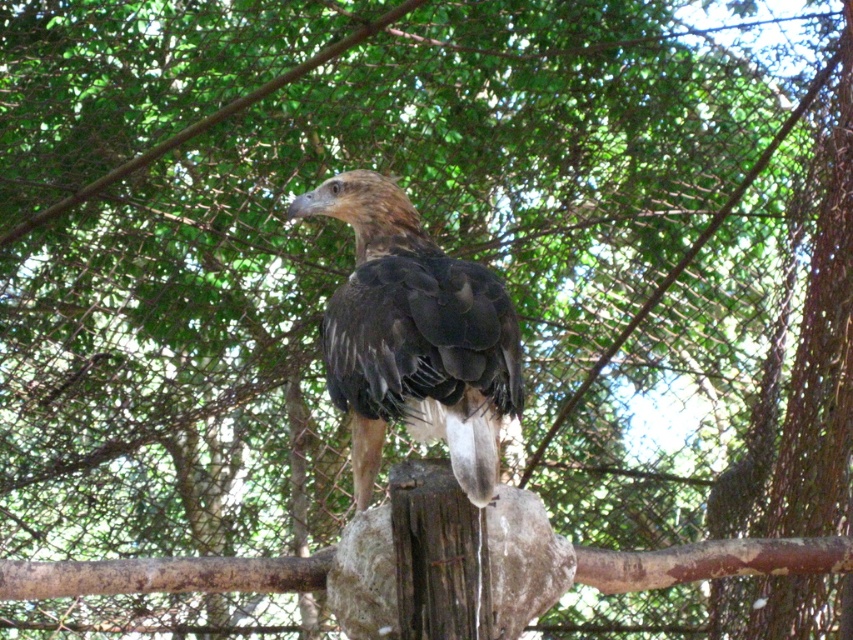
Consider the image. Can you confirm if brown feathered eagle at center is positioned to the left of smooth gray stone at center?

Correct, you'll find brown feathered eagle at center to the left of smooth gray stone at center.

Is brown feathered eagle at center closer to camera compared to smooth gray stone at center?

Yes, it is.

The image size is (853, 640). Describe the element at coordinates (415, 337) in the screenshot. I see `brown feathered eagle at center` at that location.

The height and width of the screenshot is (640, 853). I want to click on brown feathered eagle at center, so click(x=415, y=337).